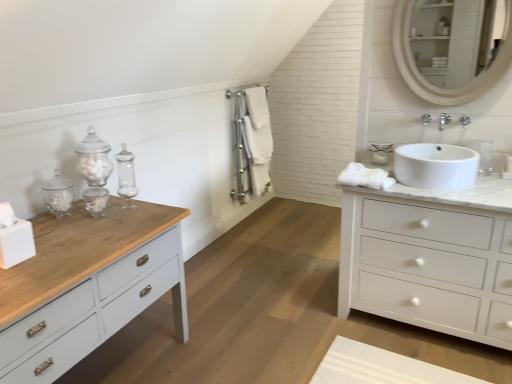
Find the location of a particular element. The height and width of the screenshot is (384, 512). free space to the left of white matte chest of drawers at right is located at coordinates (310, 317).